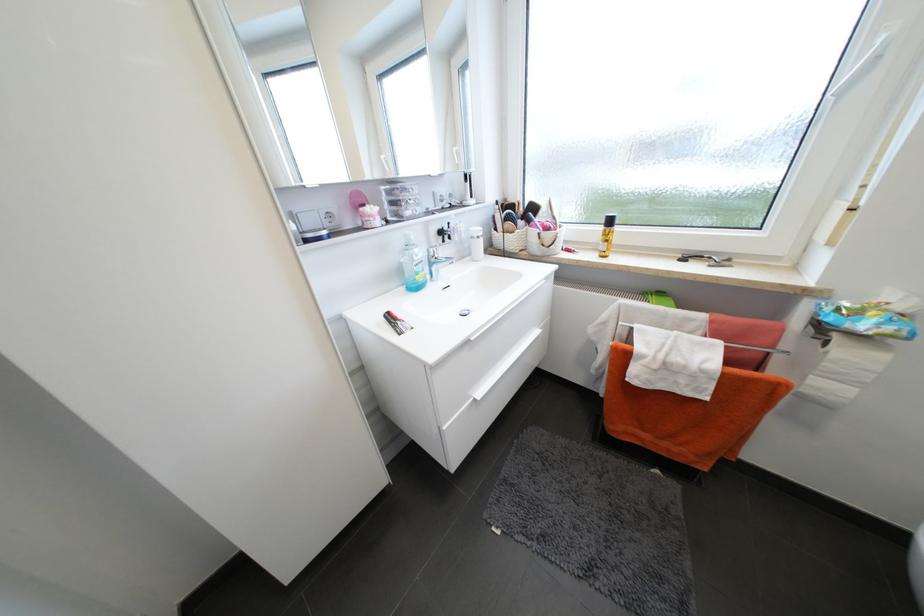
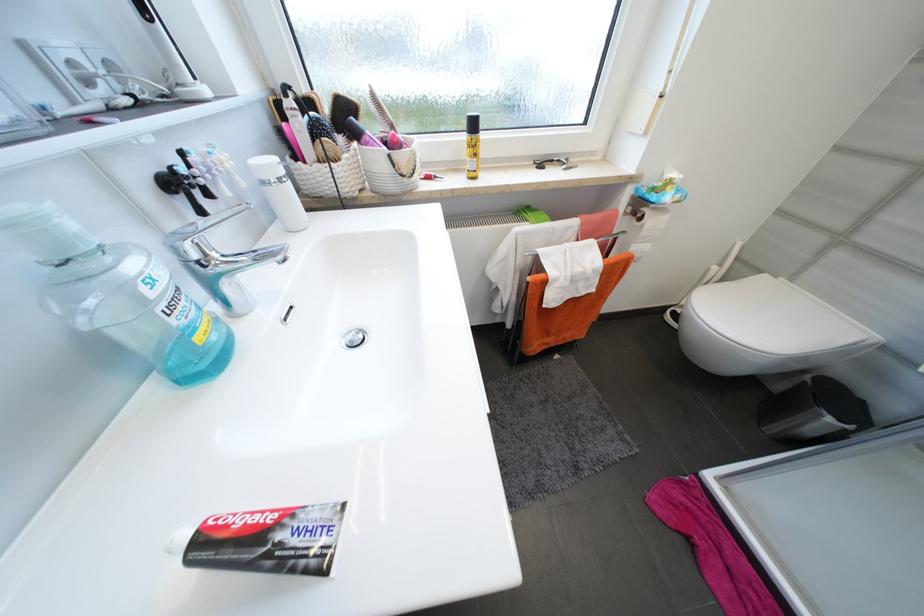
Where in the second image is the point corresponding to point (512, 201) from the first image?

(280, 92)